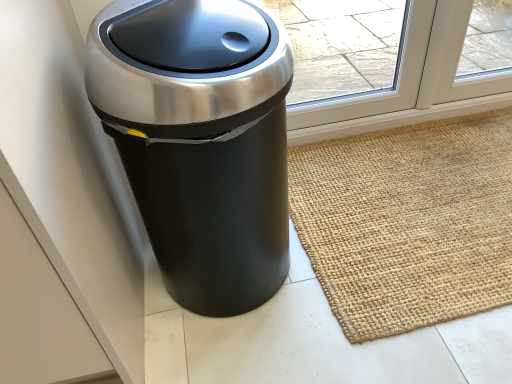
Question: From a real-world perspective, is satin black trash can at left positioned above or below natural jute doormat at lower right?

Choices:
 (A) below
 (B) above

Answer: (B)

Question: Is satin black trash can at left inside or outside of natural jute doormat at lower right?

Choices:
 (A) outside
 (B) inside

Answer: (A)

Question: Is point (197, 259) closer or farther from the camera than point (364, 241)?

Choices:
 (A) closer
 (B) farther

Answer: (A)

Question: Is natural jute doormat at lower right situated inside satin black trash can at left or outside?

Choices:
 (A) inside
 (B) outside

Answer: (B)

Question: From the image's perspective, is natural jute doormat at lower right above or below satin black trash can at left?

Choices:
 (A) above
 (B) below

Answer: (B)

Question: Considering the positions of natural jute doormat at lower right and satin black trash can at left in the image, is natural jute doormat at lower right taller or shorter than satin black trash can at left?

Choices:
 (A) short
 (B) tall

Answer: (A)

Question: From a real-world perspective, is natural jute doormat at lower right positioned above or below satin black trash can at left?

Choices:
 (A) below
 (B) above

Answer: (A)